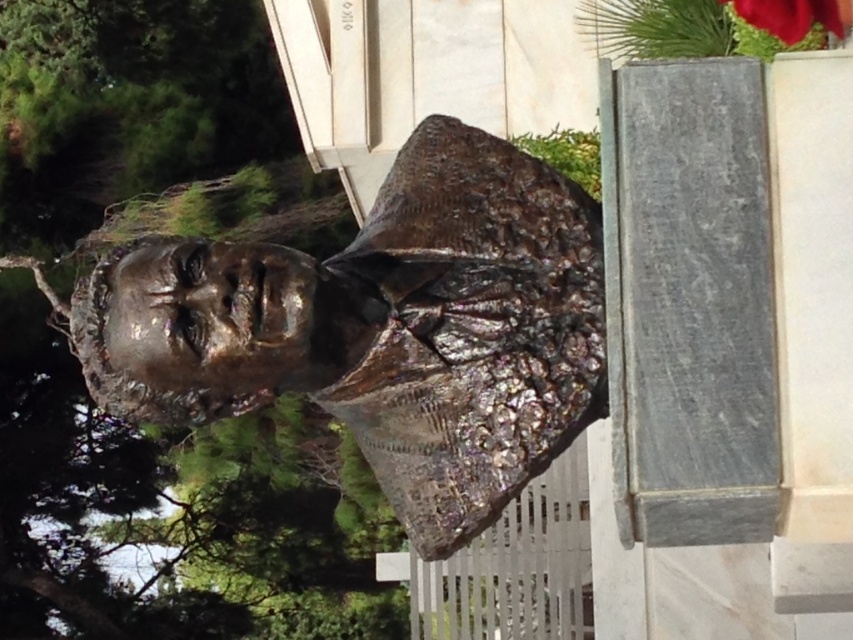
Is shiny bronze bust at center closer to the viewer compared to smooth red flower at upper right?

Yes, shiny bronze bust at center is in front of smooth red flower at upper right.

Can you confirm if shiny bronze bust at center is bigger than smooth red flower at upper right?

Indeed, shiny bronze bust at center has a larger size compared to smooth red flower at upper right.

The height and width of the screenshot is (640, 853). I want to click on shiny bronze bust at center, so click(x=381, y=328).

Locate an element on the screen. This screenshot has height=640, width=853. shiny bronze bust at center is located at coordinates (381, 328).